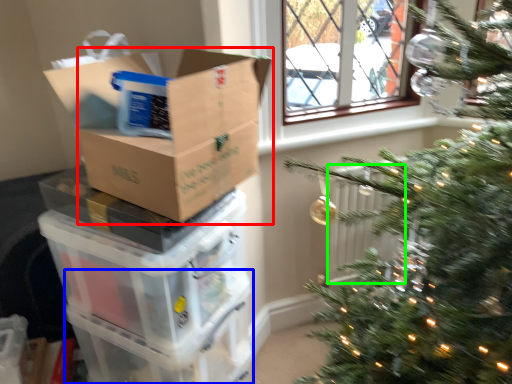
Question: Estimate the real-world distances between objects in this image. Which object is closer to cardboard box (highlighted by a red box), glass box (highlighted by a blue box) or radiator (highlighted by a green box)?

Choices:
 (A) glass box
 (B) radiator

Answer: (A)